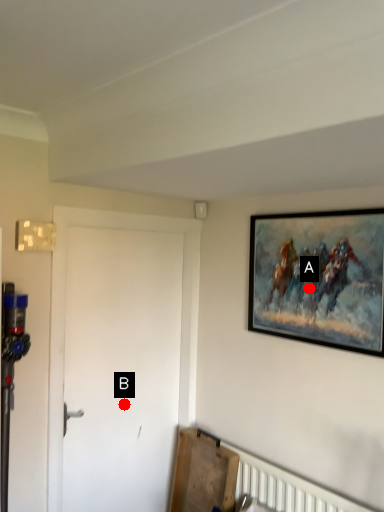
Question: Two points are circled on the image, labeled by A and B beside each circle. Which of the following is the farthest from the observer?

Choices:
 (A) A is further
 (B) B is further

Answer: (B)